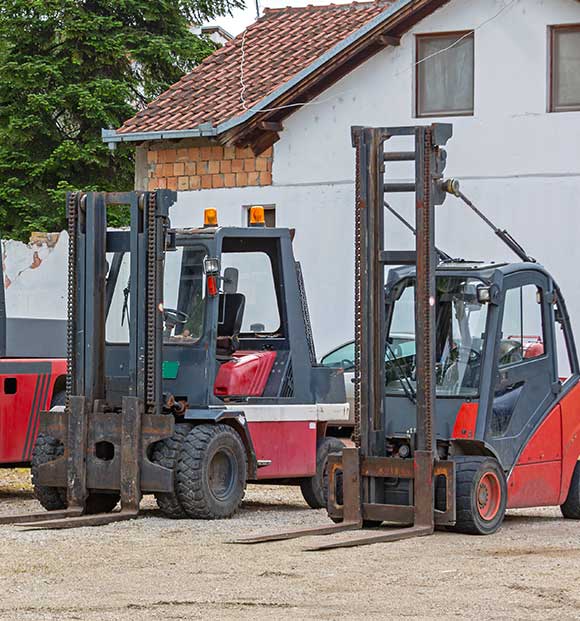
The height and width of the screenshot is (621, 580). Identify the location of seat. (230, 317).